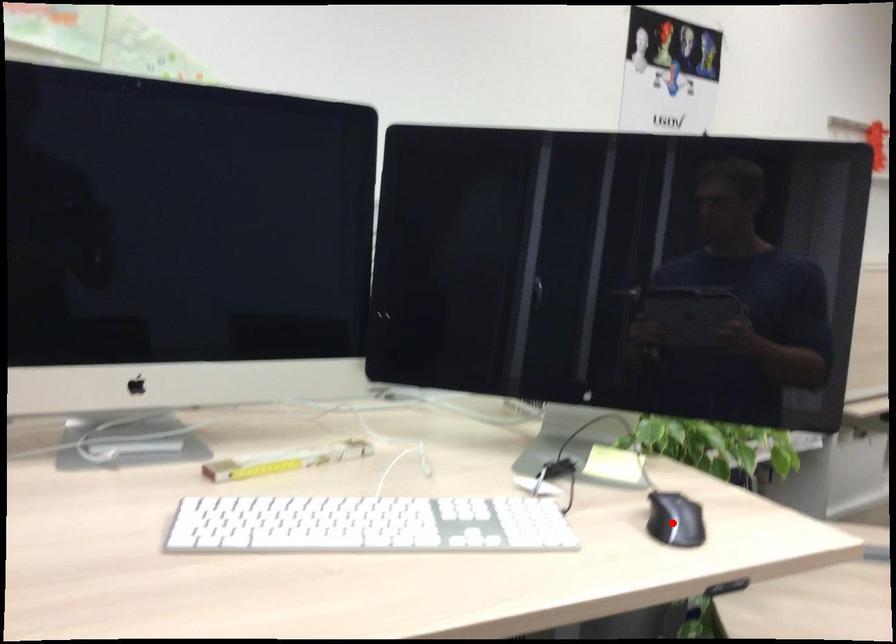
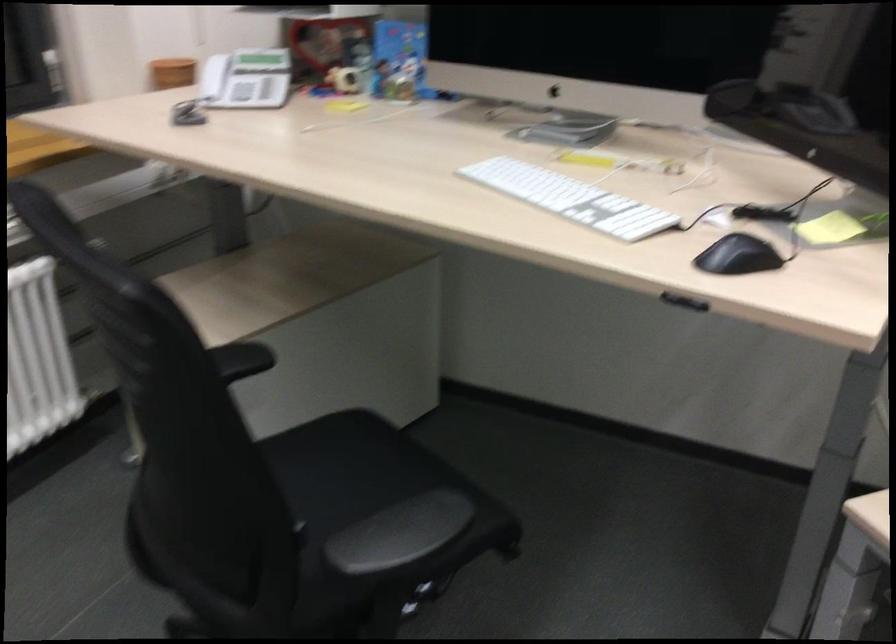
Question: I am providing you with two images of the same scene from different viewpoints. Given a red point in image1, look at the same physical point in image2. Is it:

Choices:
 (A) Closer to the viewpoint
 (B) Farther from the viewpoint

Answer: (B)